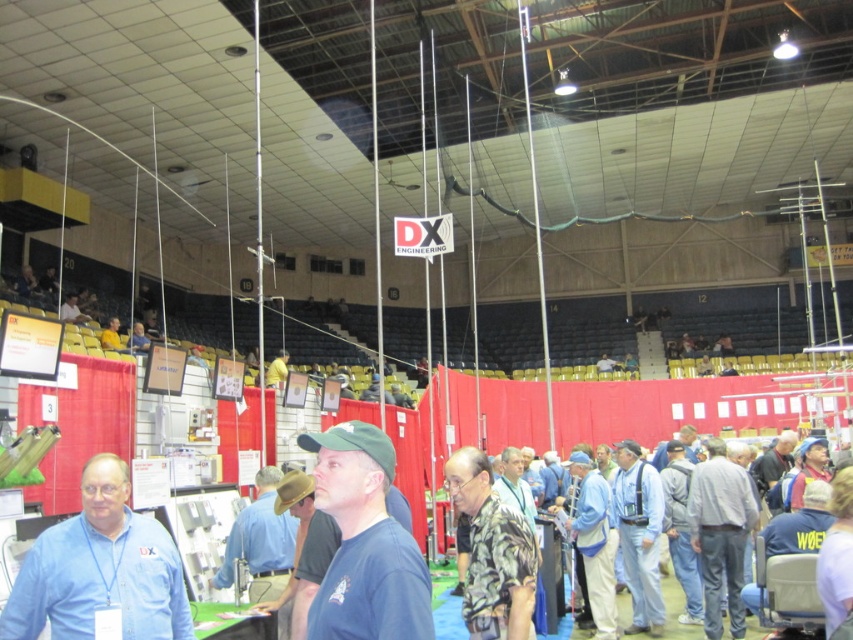
Does point (74, 609) come behind point (276, 369)?

No, it is not.

Which is more to the left, blue shirt at center or yellow fabric at center?

yellow fabric at center

The height and width of the screenshot is (640, 853). Describe the element at coordinates (100, 570) in the screenshot. I see `blue shirt at center` at that location.

The height and width of the screenshot is (640, 853). In order to click on blue shirt at center in this screenshot , I will do pos(100,570).

Does brown leather hat at center appear on the left side of gray fabric jacket at center?

Correct, you'll find brown leather hat at center to the left of gray fabric jacket at center.

Is point (281, 540) positioned after point (694, 586)?

No.

Locate an element on the screen. brown leather hat at center is located at coordinates (260, 540).

Is matte green cap at center to the right of blue denim jacket at center from the viewer's perspective?

In fact, matte green cap at center is to the left of blue denim jacket at center.

Who is positioned more to the right, matte green cap at center or blue denim jacket at center?

From the viewer's perspective, blue denim jacket at center appears more on the right side.

In the scene shown: Who is more forward, (344,524) or (589,600)?

Point (344,524) is more forward.

You are a GUI agent. You are given a task and a screenshot of the screen. Output one action in this format:
    pyautogui.click(x=<x>, y=<y>)
    Task: Click on the matte green cap at center
    Image resolution: width=853 pixels, height=640 pixels.
    Given the screenshot: What is the action you would take?
    pyautogui.click(x=364, y=541)